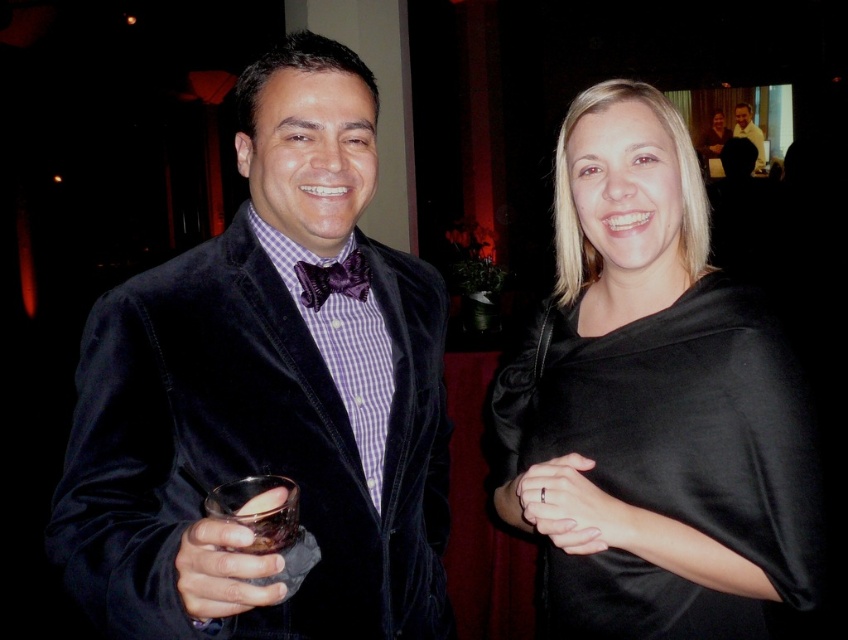
Question: Which object is positioned farthest from the matte black bow tie at upper right?

Choices:
 (A) purple velvet bow tie at center
 (B) velvet black jacket at left
 (C) shiny dark glass at center

Answer: (C)

Question: Is shiny dark glass at center bigger than purple velvet bow tie at center?

Choices:
 (A) yes
 (B) no

Answer: (A)

Question: Considering the real-world distances, which object is farthest from the black satin ring at center?

Choices:
 (A) shiny dark glass at center
 (B) velvet black jacket at left
 (C) purple velvet bow tie at center
 (D) black satin dress at center

Answer: (A)

Question: From the image, what is the correct spatial relationship of black satin ring at center in relation to purple velvet bow tie at center?

Choices:
 (A) above
 (B) below

Answer: (B)

Question: Which point is farther to the camera?

Choices:
 (A) (419, 449)
 (B) (358, 262)
 (C) (651, 540)

Answer: (A)

Question: Is velvet black jacket at left thinner than shiny dark glass at center?

Choices:
 (A) yes
 (B) no

Answer: (B)